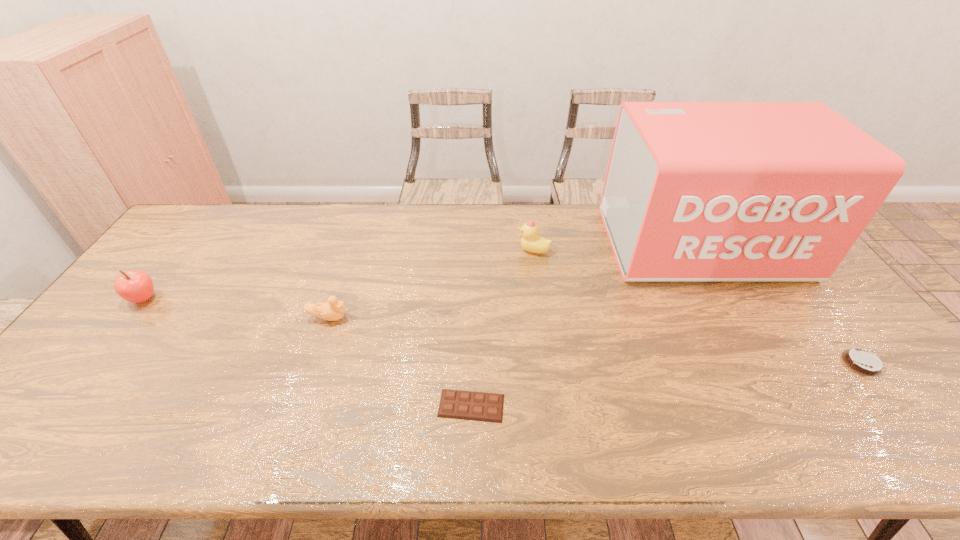
At what (x,y) coordinates should I click in order to perform the action: click on blank region between the box and the shorter duckling. Please return your answer as a coordinate pair (x, y). Image resolution: width=960 pixels, height=540 pixels. Looking at the image, I should click on (x=515, y=281).

Identify which object is the fourth nearest to the third nearest object. Please provide its 2D coordinates. Your answer should be formatted as a tuple, i.e. [(x, y)], where the tuple contains the x and y coordinates of a point satisfying the conditions above.

[(694, 191)]

Identify which object is located as the fourth nearest to the right duckling. Please provide its 2D coordinates. Your answer should be formatted as a tuple, i.e. [(x, y)], where the tuple contains the x and y coordinates of a point satisfying the conditions above.

[(863, 362)]

The width and height of the screenshot is (960, 540). I want to click on vacant space that satisfies the following two spatial constraints: 1. on the front-facing side of the taller duckling; 2. on the back side of the fifth farthest object, so click(549, 363).

You are a GUI agent. You are given a task and a screenshot of the screen. Output one action in this format:
    pyautogui.click(x=<x>, y=<y>)
    Task: Click on the free space in the image that satisfies the following two spatial constraints: 1. on the surface of the chocolate cake where the text is embossed; 2. on the left side of the tallest object
    
    Given the screenshot: What is the action you would take?
    [x=770, y=363]

The image size is (960, 540). In order to click on blank area in the image that satisfies the following two spatial constraints: 1. on the face of the shorter duckling; 2. on the left side of the shortest object in this screenshot , I will do `click(299, 406)`.

Find the location of a particular element. The image size is (960, 540). free point that satisfies the following two spatial constraints: 1. on the face of the fourth farthest object; 2. on the back side of the fifth tallest object is located at coordinates (313, 363).